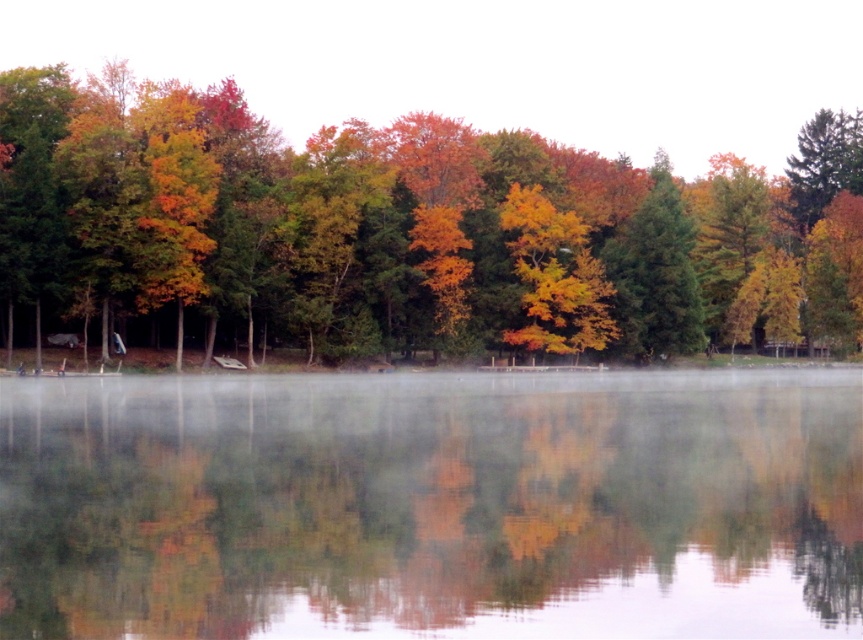
Is transparent misty water at center smaller than autumn leaves at center?

Indeed, transparent misty water at center has a smaller size compared to autumn leaves at center.

Is transparent misty water at center further to camera compared to autumn leaves at center?

No, it is not.

Is point (404, 397) more distant than point (243, 141)?

No.

Identify the location of transparent misty water at center. The width and height of the screenshot is (863, 640). (433, 506).

Between autumn leaves at center and green matte tree at center, which one has less height?

Standing shorter between the two is autumn leaves at center.

Is autumn leaves at center positioned behind green matte tree at center?

No, it is in front of green matte tree at center.

Measure the distance between autumn leaves at center and camera.

autumn leaves at center and camera are 80.21 meters apart from each other.

Image resolution: width=863 pixels, height=640 pixels. What are the coordinates of `autumn leaves at center` in the screenshot? It's located at (400, 234).

Consider the image. Is transparent misty water at center positioned before green matte tree at center?

Yes, transparent misty water at center is in front of green matte tree at center.

Is transparent misty water at center below green matte tree at center?

Yes, transparent misty water at center is below green matte tree at center.

I want to click on transparent misty water at center, so click(x=433, y=506).

The height and width of the screenshot is (640, 863). I want to click on transparent misty water at center, so click(x=433, y=506).